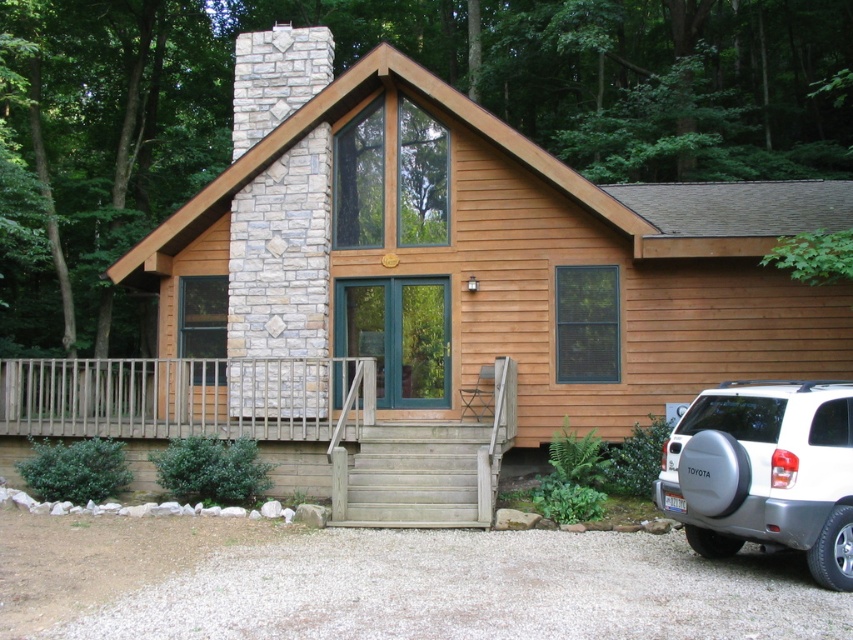
Is wooden cabin at center to the right of wooden porch at center from the viewer's perspective?

Indeed, wooden cabin at center is positioned on the right side of wooden porch at center.

Which of these two, wooden cabin at center or wooden porch at center, stands taller?

wooden cabin at center is taller.

Is point (235, 120) behind point (498, 360)?

Yes, it is behind point (498, 360).

Where is `wooden cabin at center`? wooden cabin at center is located at coordinates (474, 253).

Is the position of silver metallic suv at lower right less distant than that of wooden stairs at center?

Yes.

In the scene shown: Is silver metallic suv at lower right wider than wooden stairs at center?

In fact, silver metallic suv at lower right might be narrower than wooden stairs at center.

Between point (711, 506) and point (410, 481), which one is positioned in front?

Point (711, 506)

The image size is (853, 640). I want to click on silver metallic suv at lower right, so click(x=764, y=472).

Who is taller, wooden porch at center or silver metallic suv at lower right?

silver metallic suv at lower right

Is point (277, 362) closer to camera compared to point (699, 442)?

No, it is not.

You are a GUI agent. You are given a task and a screenshot of the screen. Output one action in this format:
    pyautogui.click(x=<x>, y=<y>)
    Task: Click on the wooden porch at center
    
    Given the screenshot: What is the action you would take?
    pyautogui.click(x=279, y=424)